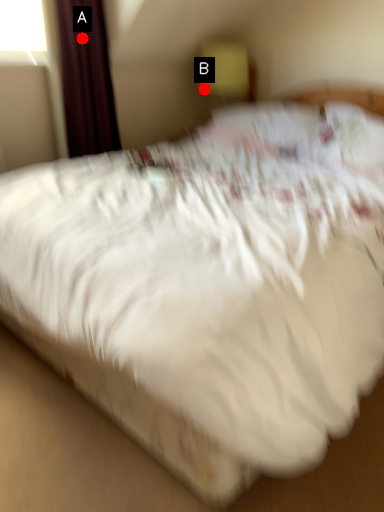
Question: Two points are circled on the image, labeled by A and B beside each circle. Which point appears closest to the camera in this image?

Choices:
 (A) A is closer
 (B) B is closer

Answer: (A)